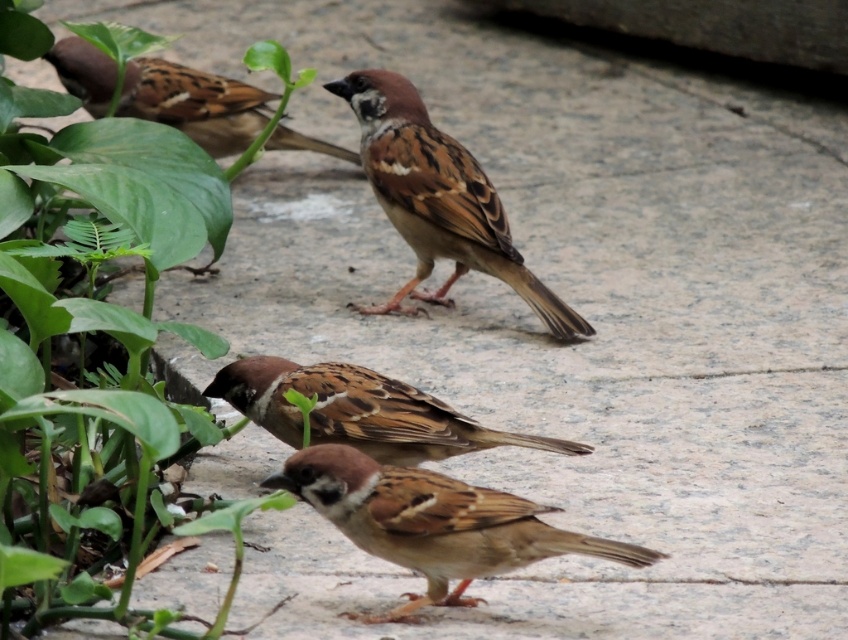
You are a birdwatcher observing the sparrows. You notice two birds at the center of the image. Which sparrow is closer to you, the brown speckled sparrow at center or the brown feathered sparrow at center?

The brown speckled sparrow at center is closer to you because it is further to the viewer than the brown feathered sparrow at center.

You are a birdwatcher observing the scene. You notice the brown speckled feathers at center and the brown speckled sparrow at upper center. Which object is smaller in size?

The brown speckled feathers at center are smaller in size compared to the brown speckled sparrow at upper center.